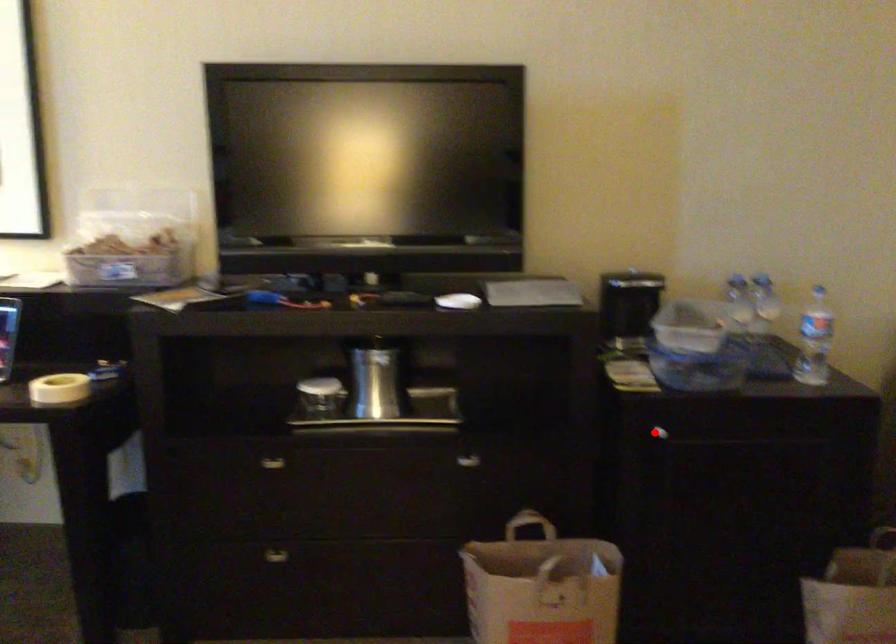
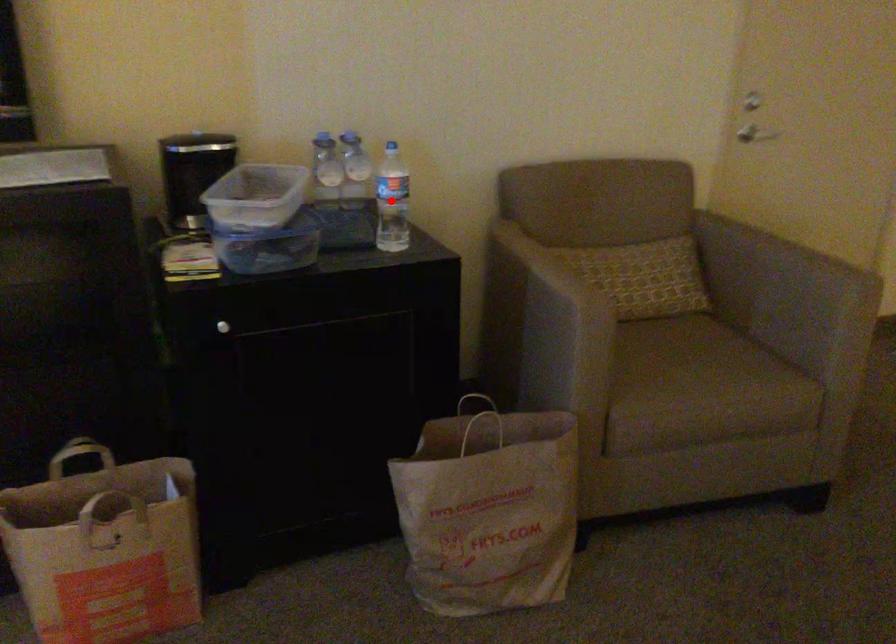
I am providing you with two images of the same scene from different viewpoints. A red point is marked on the first image and another point is marked on the second image. Is the red point in image1 aligned with the point shown in image2?

No